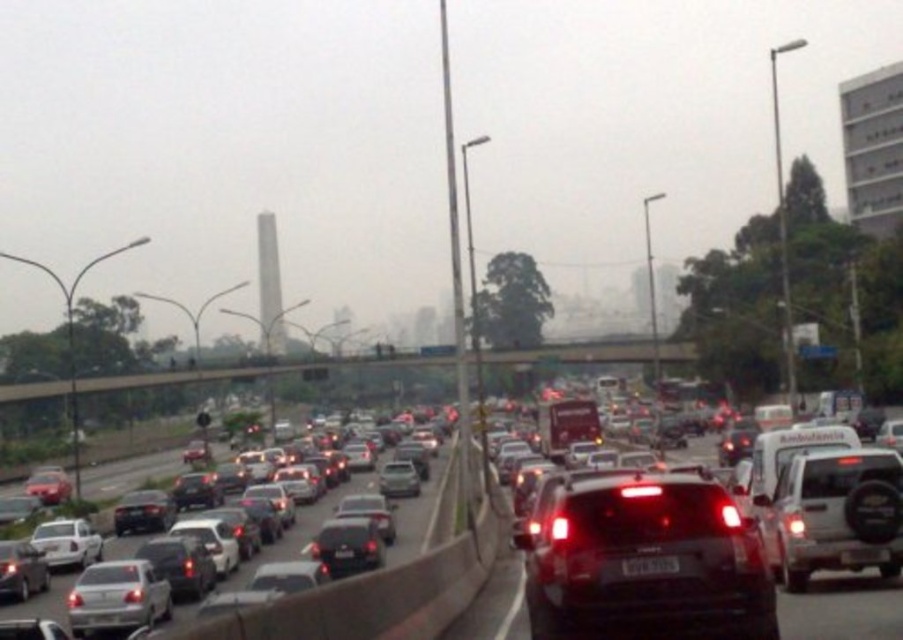
You are a pedestrian standing at the edge of the road and see the metallic cars at center and the black plastic license plate at center. Which object is closer to you?

The black plastic license plate at center is closer to you because it is positioned above the metallic cars at center, meaning the license plate is in a forward position relative to the cars.

You are a delivery driver who needs to park your vehicle in an area that is not occupied. You see a point at coordinate (643,556). Is there a vehicle parked at that point?

Yes, there is a satin black suv at center parked at point (643,556).